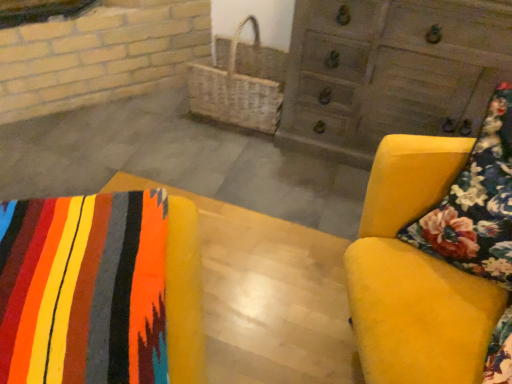
This screenshot has height=384, width=512. In order to click on vacant area situated to the left side of woven wicker basket at center in this screenshot , I will do point(151,110).